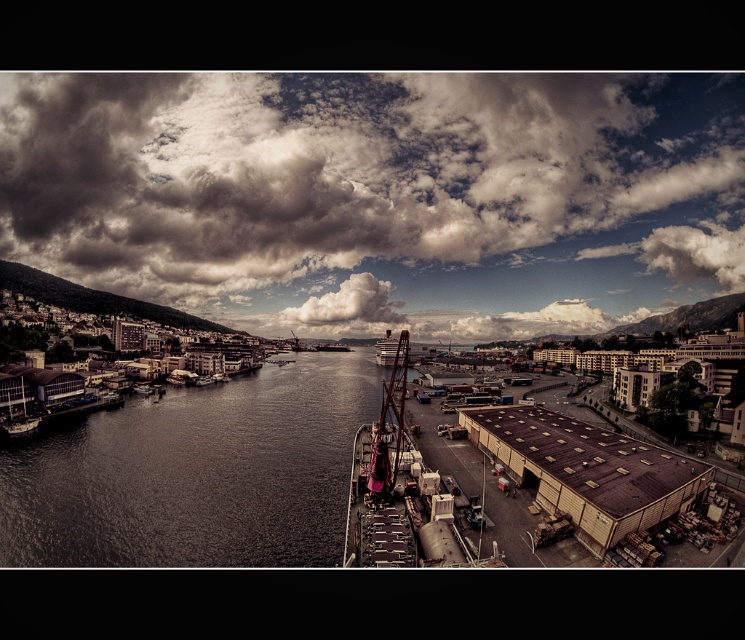
Question: Which object is closer to the camera taking this photo?

Choices:
 (A) dark brown water at center
 (B) brown corrugated metal dock at lower right

Answer: (B)

Question: Which object appears farthest from the camera in this image?

Choices:
 (A) white fluffy cloud at upper center
 (B) brown corrugated metal dock at lower right
 (C) cloudy sky at upper center

Answer: (C)

Question: Can you confirm if cloudy sky at upper center is positioned to the left of metallic gray crane at center?

Choices:
 (A) yes
 (B) no

Answer: (A)

Question: Observing the image, what is the correct spatial positioning of brown corrugated metal dock at lower right in reference to metallic gray crane at center?

Choices:
 (A) right
 (B) left

Answer: (A)

Question: Which of the following is the closest to the observer?

Choices:
 (A) cloudy sky at upper center
 (B) brown corrugated metal dock at lower right

Answer: (B)

Question: Can you confirm if dark brown water at center is positioned above brown corrugated metal dock at lower right?

Choices:
 (A) no
 (B) yes

Answer: (A)